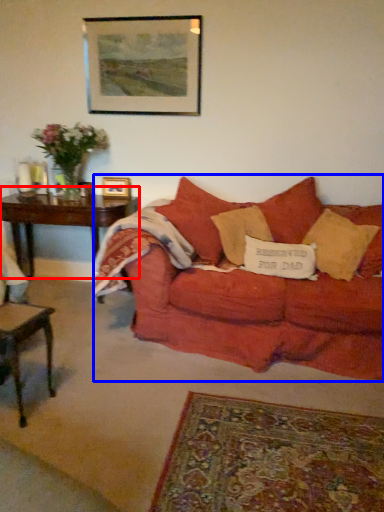
Question: Which of the following is the farthest to the observer, table (highlighted by a red box) or studio couch (highlighted by a blue box)?

Choices:
 (A) table
 (B) studio couch

Answer: (A)